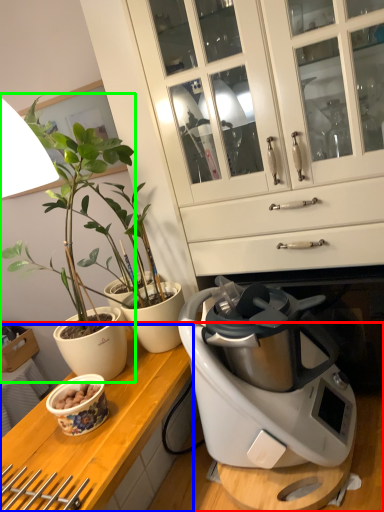
Question: Which object is positioned closest to countertop (highlighted by a red box)? Select from counter top (highlighted by a blue box) and houseplant (highlighted by a green box).

Choices:
 (A) counter top
 (B) houseplant

Answer: (A)